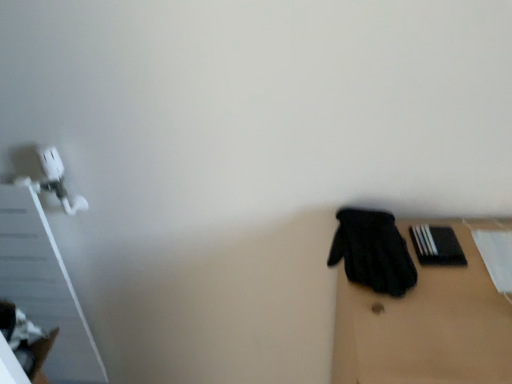
Where is `free space above black matte gloves at right (from a real-world perspective)`? free space above black matte gloves at right (from a real-world perspective) is located at coordinates (451, 286).